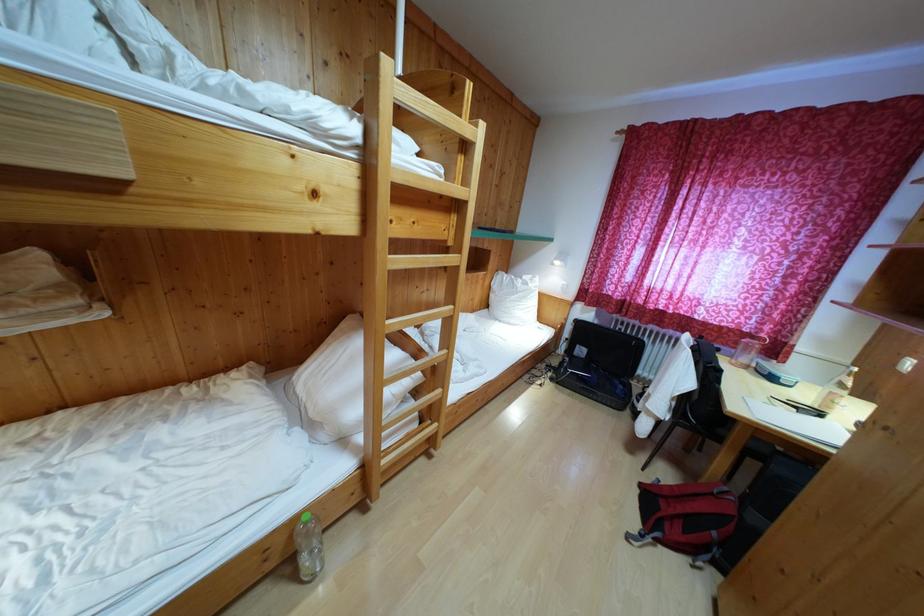
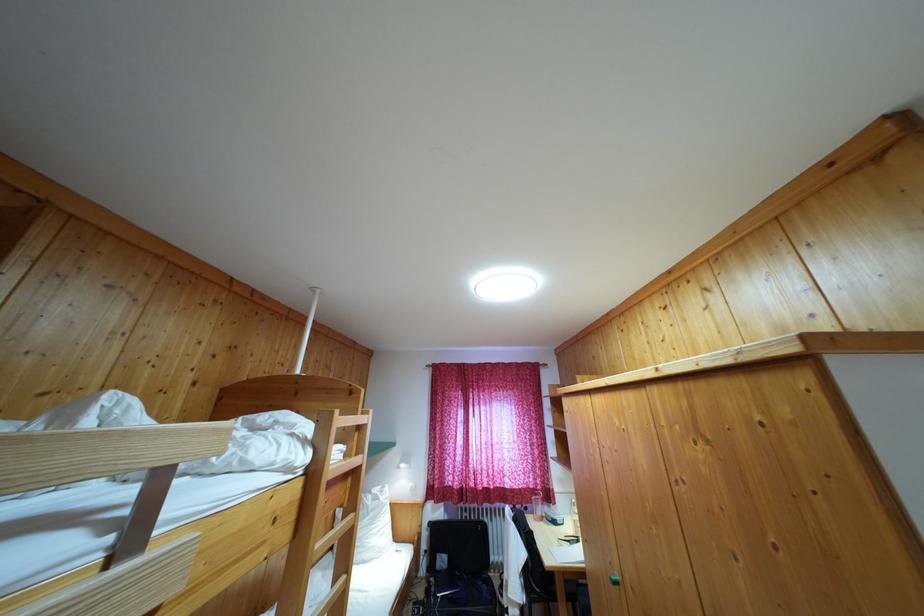
In the second image, find the point that corresponds to [585,359] in the first image.

(445, 567)